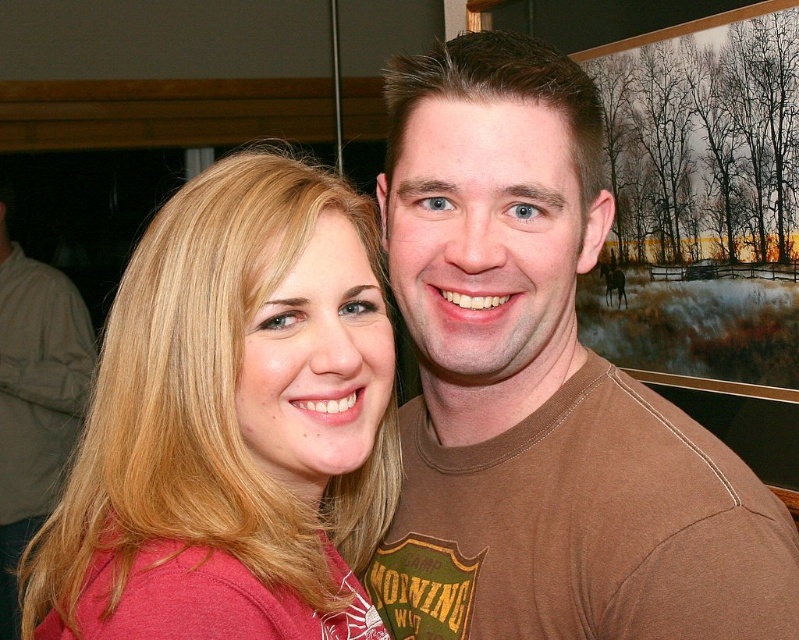
You are a photographer trying to adjust the lighting for a portrait. You notice the matte red shirt at left and the blonde hair at left in the frame. Which object is positioned higher in the image?

The matte red shirt at left is positioned higher in the image than the blonde hair at left, as it is described to be above it.

You are standing in front of the photograph and want to locate the matte red shirt at left. What are the coordinates where you should look?

The coordinates to locate the matte red shirt at left are at point (231, 424).

You are taking a photo of two people standing in front of a winter landscape painting. You want to focus on the person closer to the camera. Which of the two points, point [295,349] or point [48,278], should you focus on?

Point [295,349] is closer to the camera than point [48,278], so you should focus on point [295,349] to capture the person closer to the camera.